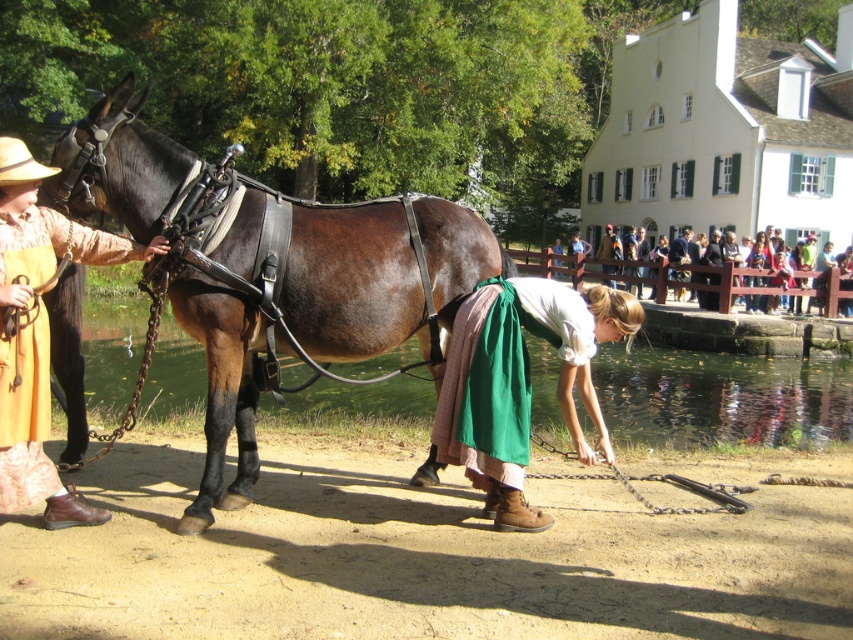
Question: Which point is farther to the camera?

Choices:
 (A) green fabric skirt at lower center
 (B) matte yellow apron at left
 (C) shiny brown leather harness at center

Answer: (C)

Question: Does green fabric skirt at lower center appear on the left side of matte yellow apron at left?

Choices:
 (A) yes
 (B) no

Answer: (B)

Question: Is the position of shiny brown leather harness at center less distant than that of green fabric skirt at lower center?

Choices:
 (A) no
 (B) yes

Answer: (A)

Question: Which object appears farthest from the camera in this image?

Choices:
 (A) shiny brown leather harness at center
 (B) matte yellow apron at left
 (C) green fabric skirt at lower center

Answer: (A)

Question: Among these points, which one is nearest to the camera?

Choices:
 (A) pyautogui.click(x=463, y=435)
 (B) pyautogui.click(x=42, y=326)

Answer: (B)

Question: Does shiny brown leather harness at center appear on the left side of green fabric skirt at lower center?

Choices:
 (A) no
 (B) yes

Answer: (B)